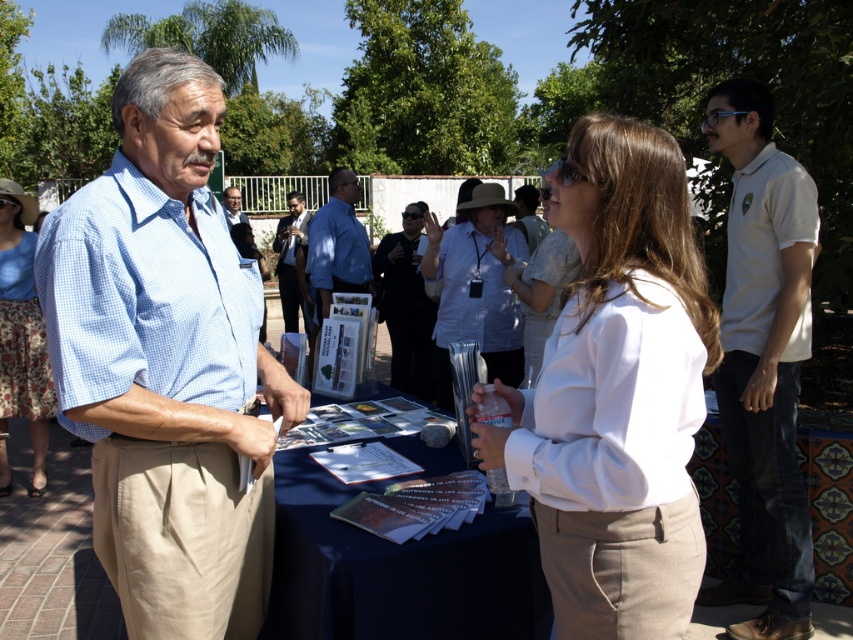
Is point (618, 493) closer to viewer compared to point (741, 628)?

Yes, it is in front of point (741, 628).

Who is more forward, (x=675, y=528) or (x=756, y=346)?

Point (x=675, y=528) is more forward.

Who is more distant from viewer, (654, 410) or (776, 515)?

Point (776, 515)

Where is `white cotton blouse at center`? white cotton blouse at center is located at coordinates (618, 394).

Is point (787, 326) farther from camera compared to point (415, 324)?

No, it is in front of (415, 324).

Does white cotton polo shirt at right have a greater width compared to matte blue shirt at center?

Incorrect, white cotton polo shirt at right's width does not surpass matte blue shirt at center's.

Locate an element on the screen. The width and height of the screenshot is (853, 640). white cotton polo shirt at right is located at coordinates tap(764, 360).

Between light blue checkered shirt at center and blue shirt at center, which one appears on the left side from the viewer's perspective?

From the viewer's perspective, blue shirt at center appears more on the left side.

Image resolution: width=853 pixels, height=640 pixels. In order to click on light blue checkered shirt at center in this screenshot , I will do `click(166, 364)`.

Locate an element on the screen. The width and height of the screenshot is (853, 640). light blue checkered shirt at center is located at coordinates (166, 364).